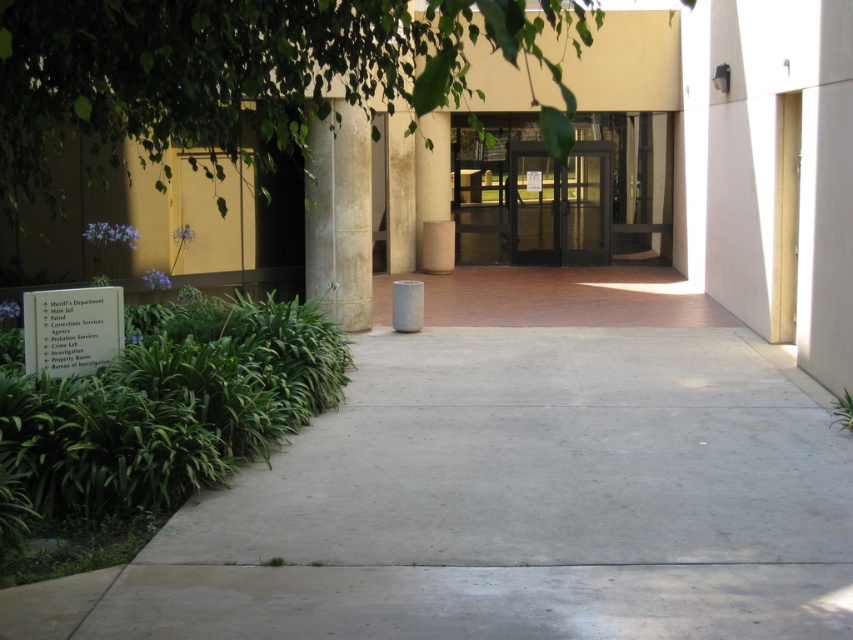
Question: Is gray concrete pavement at center to the left of green leafy tree at upper center from the viewer's perspective?

Choices:
 (A) no
 (B) yes

Answer: (A)

Question: Among these points, which one is nearest to the camera?

Choices:
 (A) (358, 116)
 (B) (546, 248)

Answer: (A)

Question: Can you confirm if gray concrete pavement at center is wider than white stone pillar at center?

Choices:
 (A) no
 (B) yes

Answer: (A)

Question: Among these objects, which one is farthest from the camera?

Choices:
 (A) green leafy tree at upper center
 (B) white stone pillar at center
 (C) transparent glass doors at center

Answer: (C)

Question: From the image, what is the correct spatial relationship of black glass doors at center in relation to transparent glass doors at center?

Choices:
 (A) left
 (B) right

Answer: (B)

Question: Which of the following is the closest to the observer?

Choices:
 (A) transparent glass doors at center
 (B) white stone pillar at center
 (C) black glass doors at center

Answer: (B)